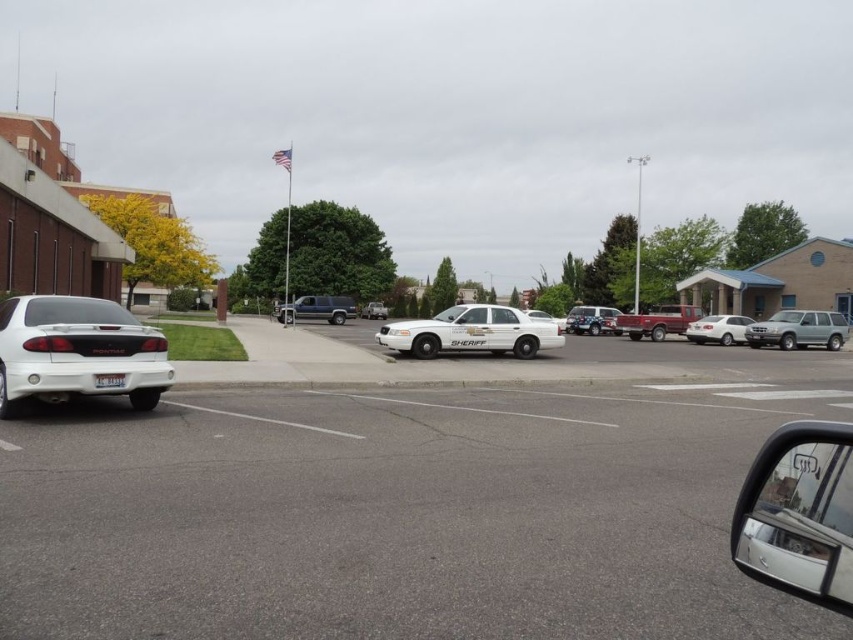
Question: Which of the following is the closest to the observer?

Choices:
 (A) (544, 316)
 (B) (718, 340)
 (C) (476, 308)
 (D) (369, 312)

Answer: (C)

Question: Can you confirm if white glossy sheriff car at center is positioned above white matte sheriff car at center?

Choices:
 (A) no
 (B) yes

Answer: (A)

Question: Among these points, which one is nearest to the camera?

Choices:
 (A) (815, 340)
 (B) (91, 339)
 (C) (534, 316)

Answer: (B)

Question: Does white matte van at center have a greater width compared to white matte sheriff car at center?

Choices:
 (A) no
 (B) yes

Answer: (A)

Question: Which of the following is the farthest from the observer?

Choices:
 (A) (592, 333)
 (B) (445, 321)

Answer: (A)

Question: Does white glossy sedan at lower left appear on the left side of white glossy sedan at center-right?

Choices:
 (A) no
 (B) yes

Answer: (B)